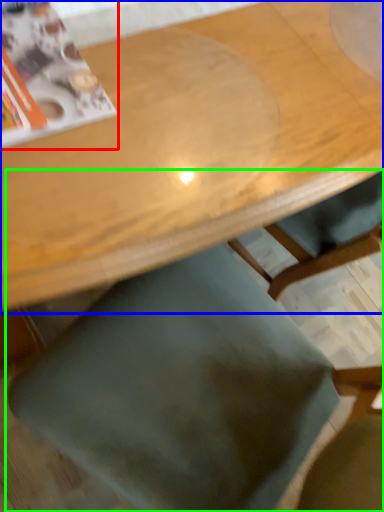
Question: Which object is the closest to the magazine (highlighted by a red box)? Choose among these: table (highlighted by a blue box) or chair (highlighted by a green box).

Choices:
 (A) table
 (B) chair

Answer: (A)